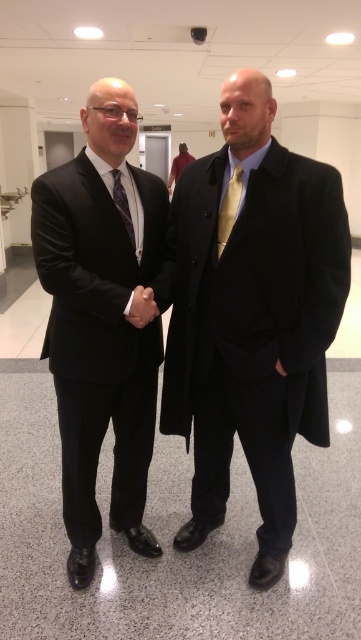
You are an interior designer assessing the layout of this corridor. The point at coordinates (228, 208) marks a specific object in the scene. Which object is located at this coordinate?

The point at coordinates (228, 208) marks the gold silk tie at center.

You are a tailor measuring the distance between two black accessories in a photo. The accessories are the matte black coat at center and the matte black tie at center. The client wants to know if they can fit a 20 inch wide decorative ribbon between them. Can they?

The distance between the matte black coat at center and the matte black tie at center is 23.35 inches. Since the ribbon is 20 inches wide, it can fit between them as there is enough space.

You are a photographer trying to capture a photo of the two subjects in the scene. You notice that the matte black coat at center and the matte black hand at center might overlap in the image. Based on their positions, which object will appear larger in the final photo?

The matte black coat at center will appear larger in the photo because it is much taller than the matte black hand at center.